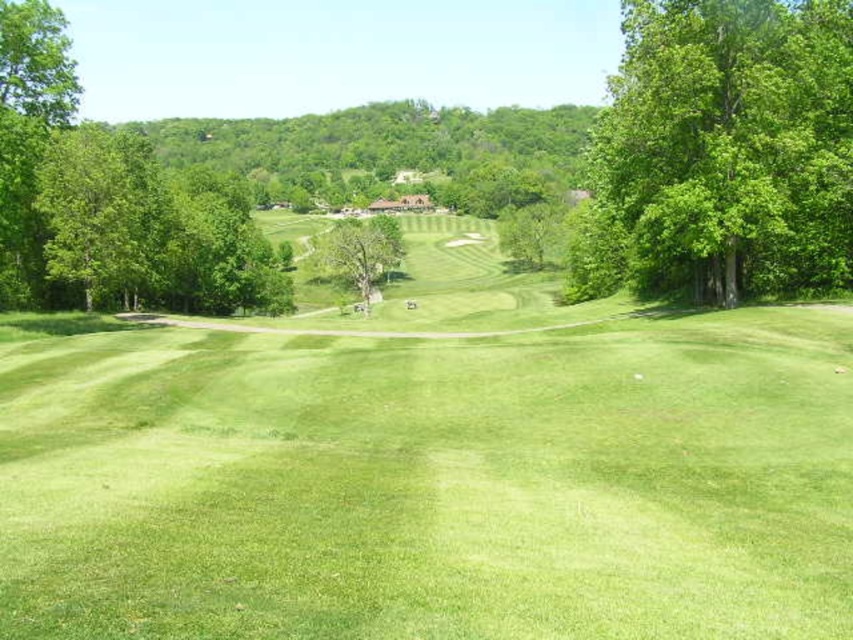
You are standing at the point marked by the coordinates point (430, 468) on the golf course. Looking around, what is the immediate terrain you are standing on?

The point (430, 468) marks green grassy field at center, so you are standing on a green grassy field at center.

You are a golfer standing on the tee, looking at the green grassy field at center and the green leafy tree at center. Which object takes up more area in the image?

The green leafy tree at center occupies more space than the green grassy field at center according to the description.